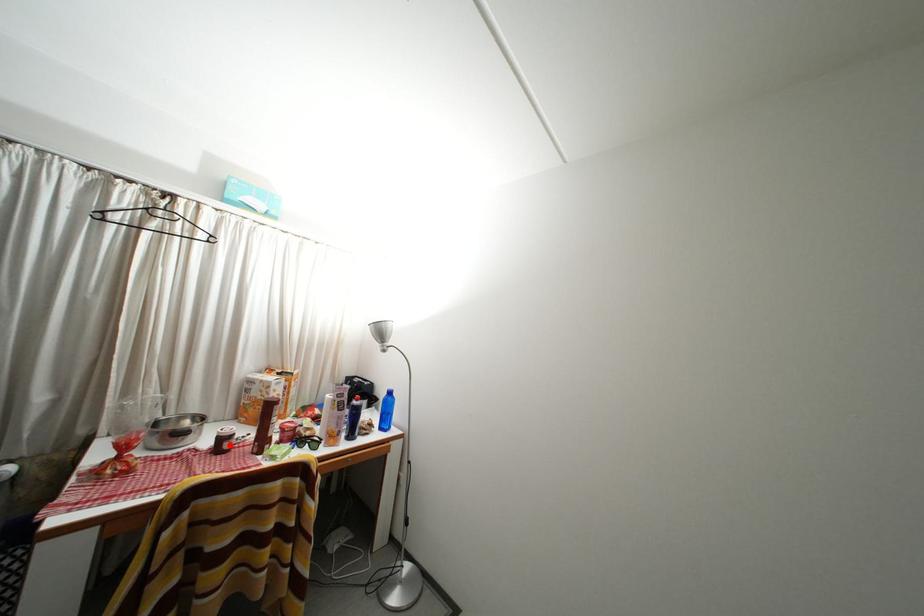
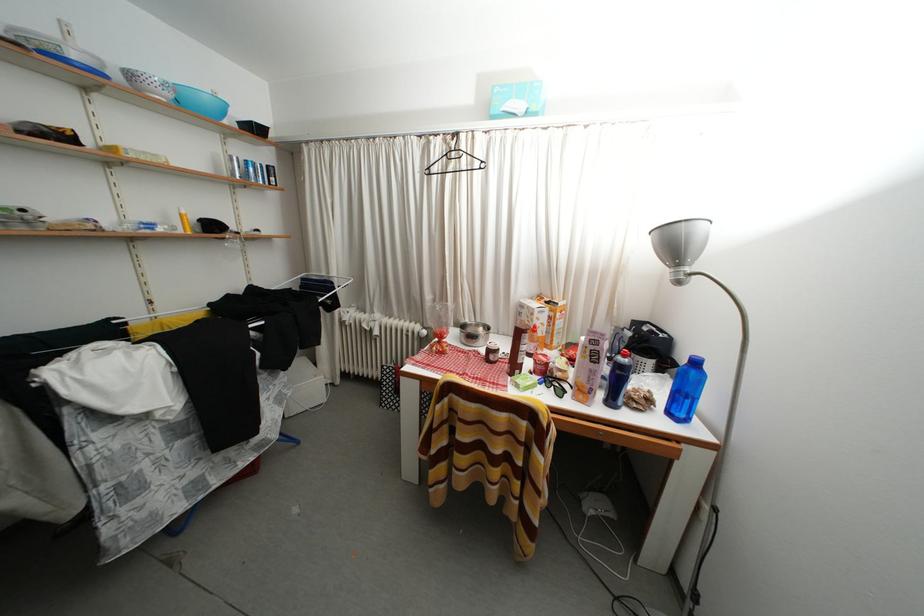
Where in the second image is the point corresponding to the highlighted location from the first image?

(496, 357)